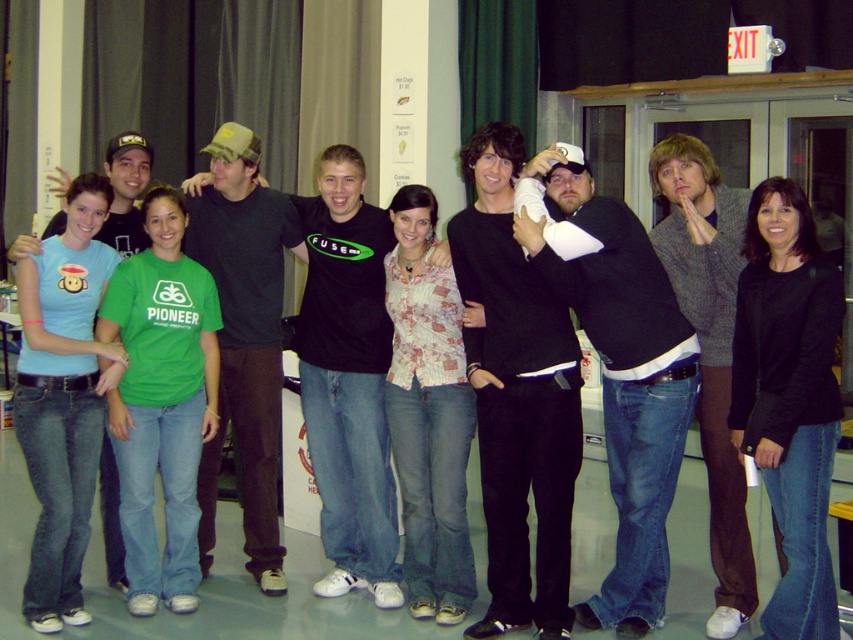
Is black matte jacket at center below black t-shirt at center?

Yes.

Does black matte jacket at center appear on the left side of black t-shirt at center?

→ In fact, black matte jacket at center is to the right of black t-shirt at center.

Measure the distance between point (x=813, y=323) and camera.

Point (x=813, y=323) and camera are 3.53 meters apart from each other.

The image size is (853, 640). Identify the location of black matte jacket at center. click(788, 397).

Which is in front, point (498, 150) or point (381, 474)?

Positioned in front is point (498, 150).

The height and width of the screenshot is (640, 853). In order to click on black matte sweater at center in this screenshot , I will do `click(517, 396)`.

The image size is (853, 640). What do you see at coordinates (517, 396) in the screenshot?
I see `black matte sweater at center` at bounding box center [517, 396].

Locate an element on the screen. The image size is (853, 640). black matte sweater at center is located at coordinates (517, 396).

Does black matte jacket at center have a larger size compared to green cotton t-shirt at center?

Yes, black matte jacket at center is bigger than green cotton t-shirt at center.

Does black matte jacket at center appear on the right side of green cotton t-shirt at center?

Indeed, black matte jacket at center is positioned on the right side of green cotton t-shirt at center.

Which is in front, point (756, 342) or point (111, 392)?

Point (756, 342) is more forward.

Where is `black matte jacket at center`? The image size is (853, 640). black matte jacket at center is located at coordinates (788, 397).